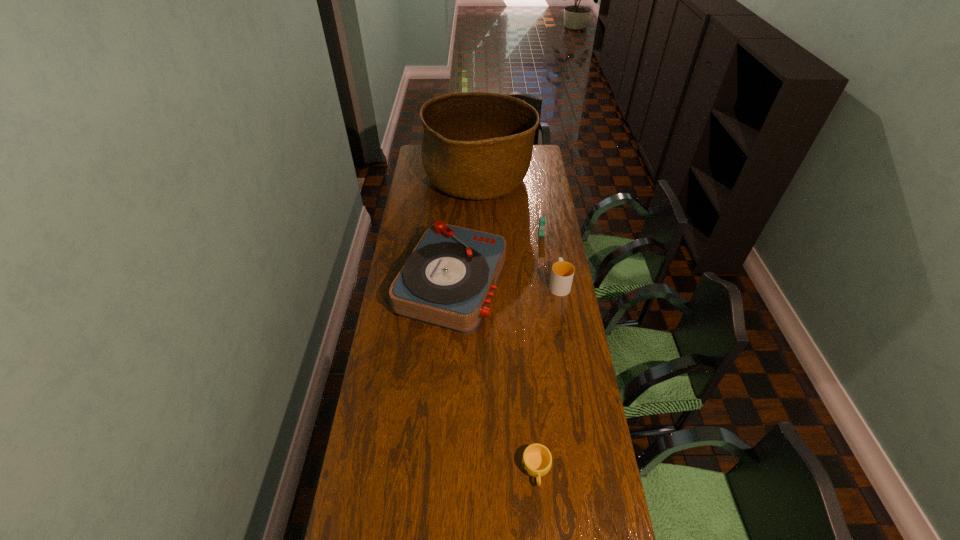
You are a GUI agent. You are given a task and a screenshot of the screen. Output one action in this format:
    pyautogui.click(x=<x>, y=<y>)
    Task: Click on the farthest object
    This screenshot has width=960, height=540.
    Given the screenshot: What is the action you would take?
    [476, 145]

You are a GUI agent. You are given a task and a screenshot of the screen. Output one action in this format:
    pyautogui.click(x=<x>, y=<y>)
    Task: Click on the basket
    
    Given the screenshot: What is the action you would take?
    pyautogui.click(x=476, y=145)

I want to click on record player, so click(x=447, y=281).

At what (x,y) coordinates should I click in order to perform the action: click on cellular telephone. Please return your answer as a coordinate pair (x, y). Image resolution: width=960 pixels, height=540 pixels. Looking at the image, I should click on (542, 221).

Locate an element on the screen. the farther cup is located at coordinates (562, 273).

The image size is (960, 540). Find the location of `the right cup`. the right cup is located at coordinates (562, 273).

The height and width of the screenshot is (540, 960). Identify the location of the shorter cup. (536, 460).

Image resolution: width=960 pixels, height=540 pixels. What are the coordinates of `the nearer cup` in the screenshot? It's located at (536, 460).

You are a GUI agent. You are given a task and a screenshot of the screen. Output one action in this format:
    pyautogui.click(x=<x>, y=<y>)
    Task: Click on the vacant area located on the front of the basket
    The image size is (960, 540).
    Given the screenshot: What is the action you would take?
    pyautogui.click(x=478, y=239)

Identify the location of free space located on the back of the record player. The image size is (960, 540). (457, 205).